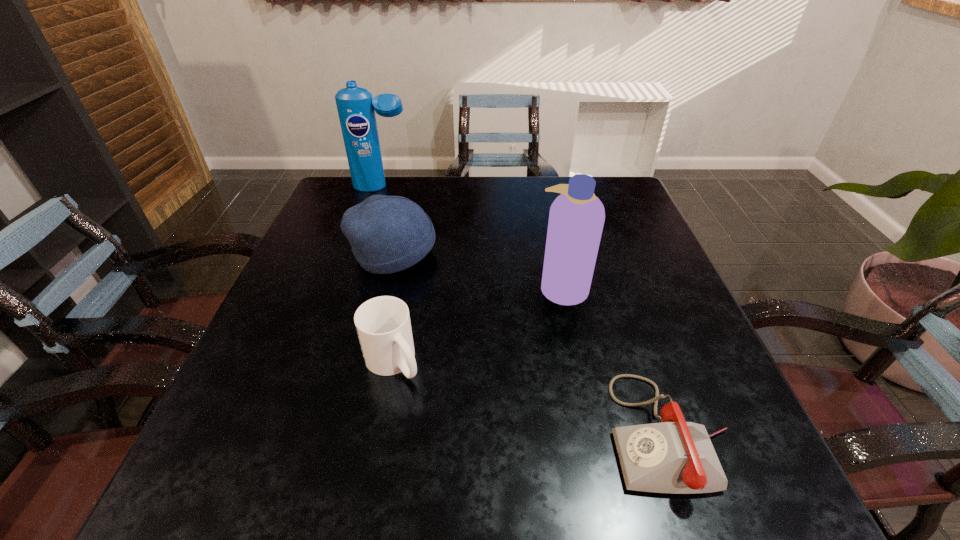
Find the location of a particular element. Image resolution: width=960 pixels, height=540 pixels. vacant region between the farthest object and the right shampoo is located at coordinates (472, 237).

What are the coordinates of `free spot between the skullcap and the nearer shampoo` in the screenshot? It's located at (478, 270).

Where is `vacant point located between the shortest object and the nearer shampoo`? The image size is (960, 540). vacant point located between the shortest object and the nearer shampoo is located at coordinates (615, 360).

The height and width of the screenshot is (540, 960). Identify the location of object that stands as the second closest to the right shampoo. (388, 234).

Locate an element on the screen. The width and height of the screenshot is (960, 540). object that stands as the closest to the left shampoo is located at coordinates (388, 234).

Where is `free location that satisfies the following two spatial constraints: 1. on the back side of the nearer shampoo; 2. on the left side of the fourth tallest object`? free location that satisfies the following two spatial constraints: 1. on the back side of the nearer shampoo; 2. on the left side of the fourth tallest object is located at coordinates (407, 287).